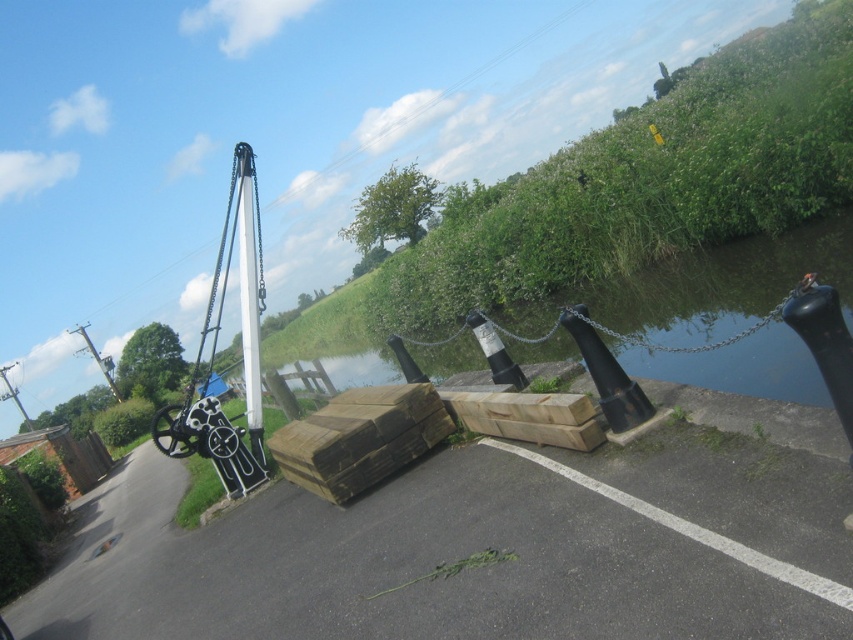
Question: Which object is farther from the camera taking this photo?

Choices:
 (A) smooth concrete waterway at center
 (B) white glossy pole at center

Answer: (B)

Question: Among these objects, which one is farthest from the camera?

Choices:
 (A) smooth concrete waterway at center
 (B) white glossy pole at center

Answer: (B)

Question: Can you confirm if smooth concrete waterway at center is wider than white glossy pole at center?

Choices:
 (A) yes
 (B) no

Answer: (A)

Question: Is smooth concrete waterway at center above white glossy pole at center?

Choices:
 (A) no
 (B) yes

Answer: (B)

Question: Does smooth concrete waterway at center have a larger size compared to white glossy pole at center?

Choices:
 (A) no
 (B) yes

Answer: (B)